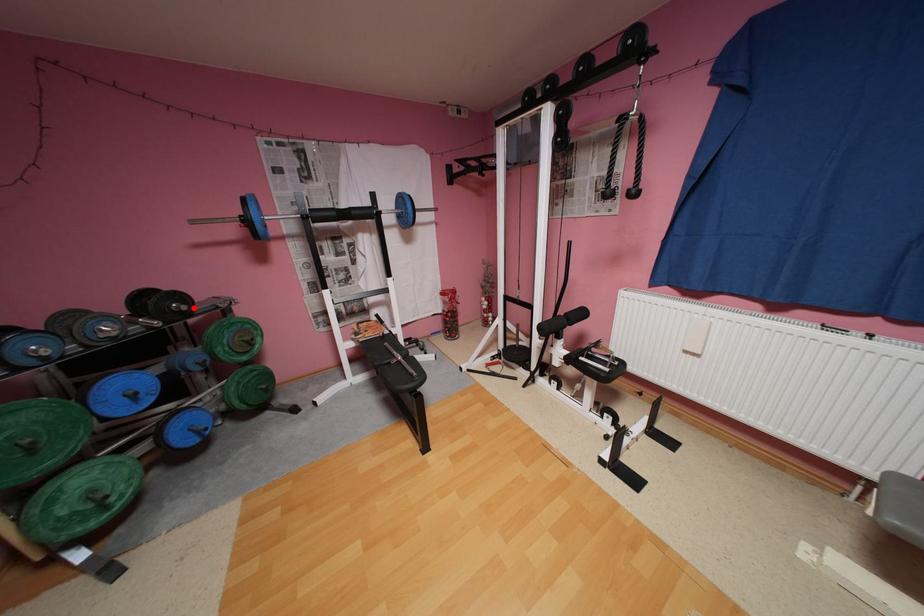
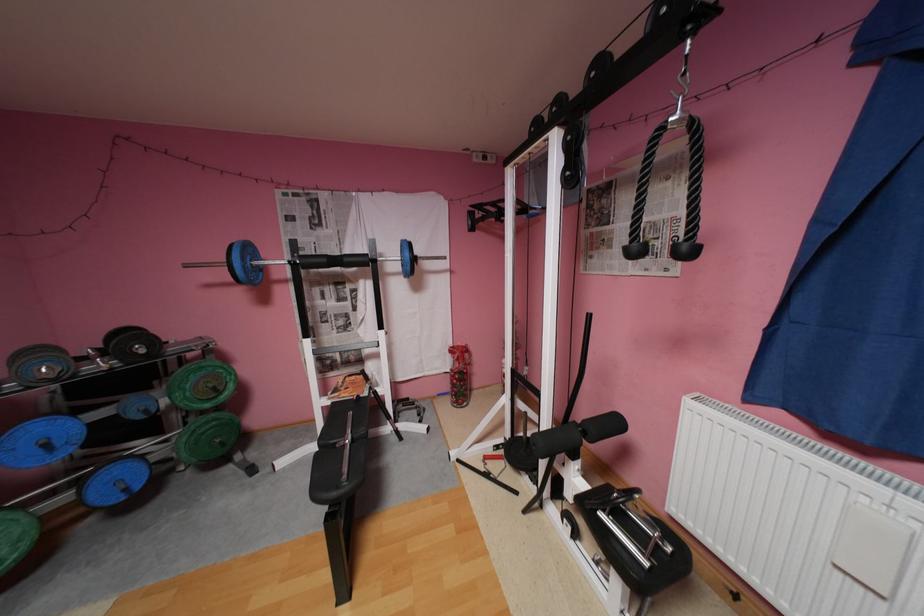
The point at the highlighted location is marked in the first image. Where is the corresponding point in the second image?

(152, 351)